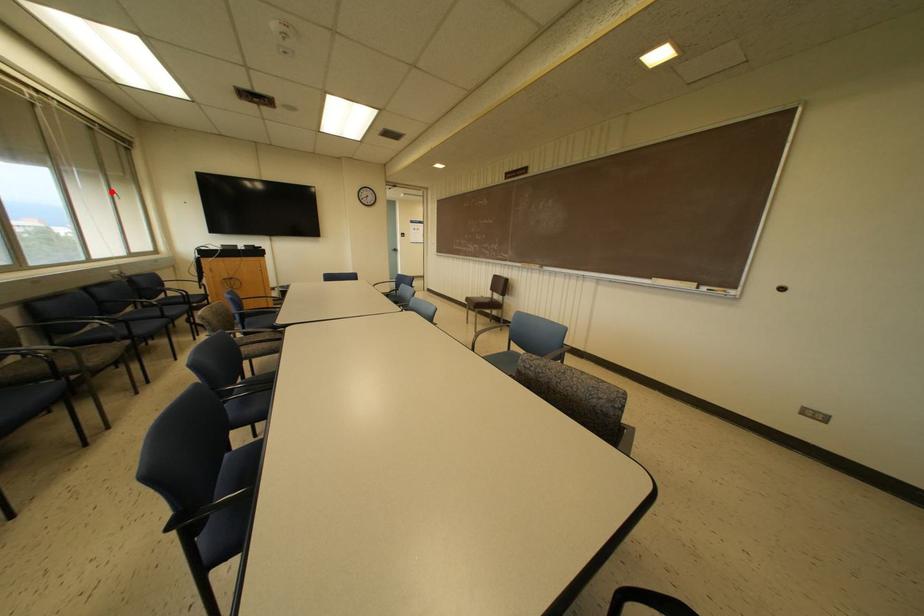
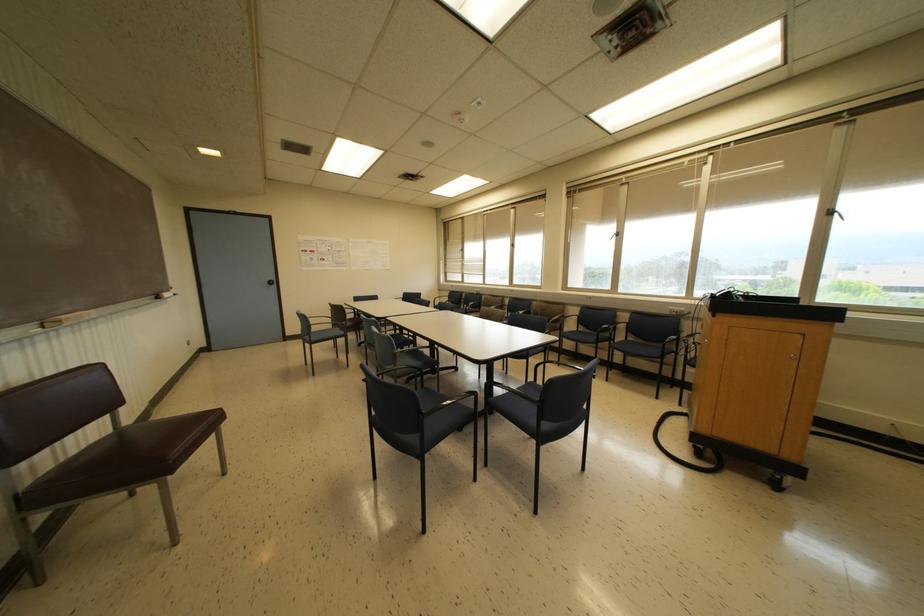
Question: I am providing you with two images of the same scene from different viewpoints. Image1 has a red point marked. In image2, the corresponding 3D location appears at what relative position? Reply with the corresponding letter.

Choices:
 (A) Closer
 (B) Farther

Answer: (B)